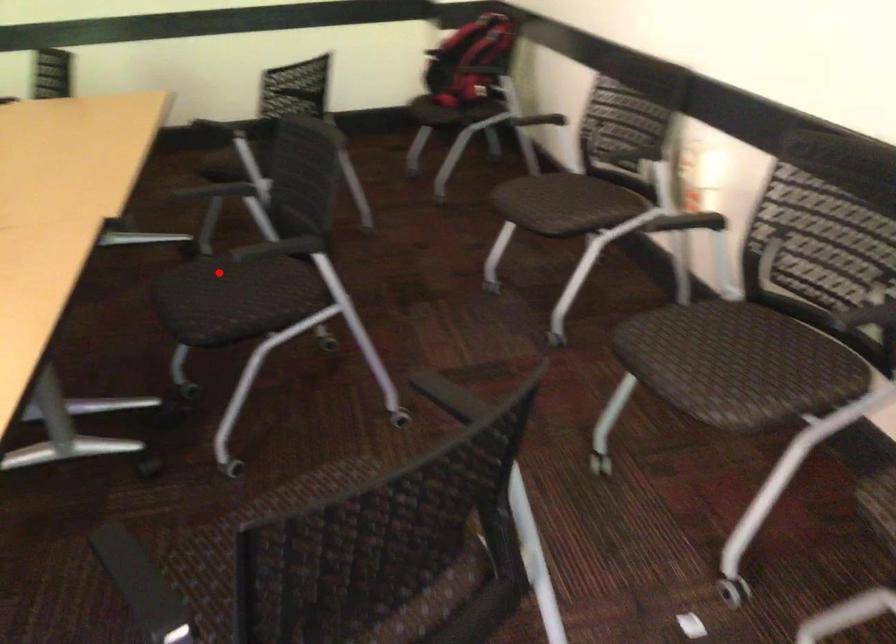
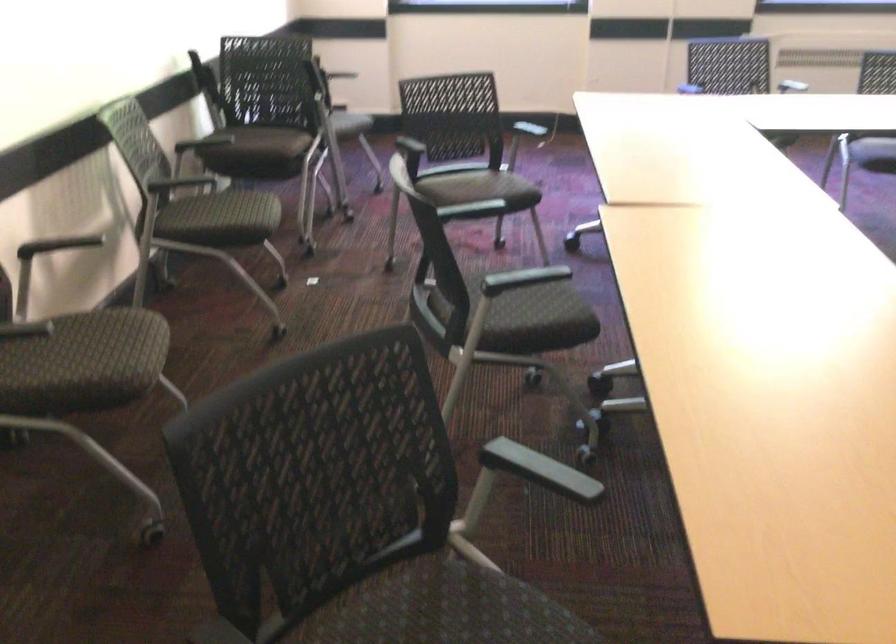
The point at the highlighted location is marked in the first image. Where is the corresponding point in the second image?

(530, 319)